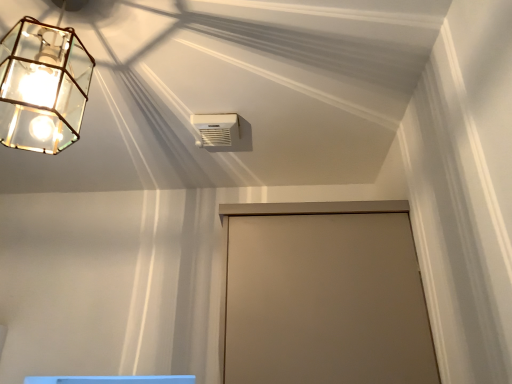
Question: Would you say white plastic air conditioning unit at upper center is outside beige matte door at center?

Choices:
 (A) no
 (B) yes

Answer: (B)

Question: Can you confirm if white plastic air conditioning unit at upper center is bigger than beige matte door at center?

Choices:
 (A) yes
 (B) no

Answer: (B)

Question: Could you tell me if white plastic air conditioning unit at upper center is facing beige matte door at center?

Choices:
 (A) yes
 (B) no

Answer: (B)

Question: Considering the relative sizes of white plastic air conditioning unit at upper center and beige matte door at center in the image provided, is white plastic air conditioning unit at upper center taller than beige matte door at center?

Choices:
 (A) no
 (B) yes

Answer: (A)

Question: Does white plastic air conditioning unit at upper center have a lesser width compared to beige matte door at center?

Choices:
 (A) yes
 (B) no

Answer: (A)

Question: From a real-world perspective, is white plastic air conditioning unit at upper center located higher than beige matte door at center?

Choices:
 (A) no
 (B) yes

Answer: (B)

Question: Is white plastic air conditioning unit at upper center touching clear glass lantern at upper left?

Choices:
 (A) yes
 (B) no

Answer: (B)

Question: Is clear glass lantern at upper left completely or partially inside white plastic air conditioning unit at upper center?

Choices:
 (A) yes
 (B) no

Answer: (B)

Question: From a real-world perspective, is white plastic air conditioning unit at upper center physically above clear glass lantern at upper left?

Choices:
 (A) no
 (B) yes

Answer: (B)

Question: Considering the relative sizes of white plastic air conditioning unit at upper center and clear glass lantern at upper left in the image provided, is white plastic air conditioning unit at upper center smaller than clear glass lantern at upper left?

Choices:
 (A) no
 (B) yes

Answer: (B)

Question: Can you confirm if white plastic air conditioning unit at upper center is positioned to the right of clear glass lantern at upper left?

Choices:
 (A) no
 (B) yes

Answer: (B)

Question: Would you say white plastic air conditioning unit at upper center is a long distance from clear glass lantern at upper left?

Choices:
 (A) yes
 (B) no

Answer: (B)

Question: Is beige matte door at center taller than white plastic air conditioning unit at upper center?

Choices:
 (A) yes
 (B) no

Answer: (A)